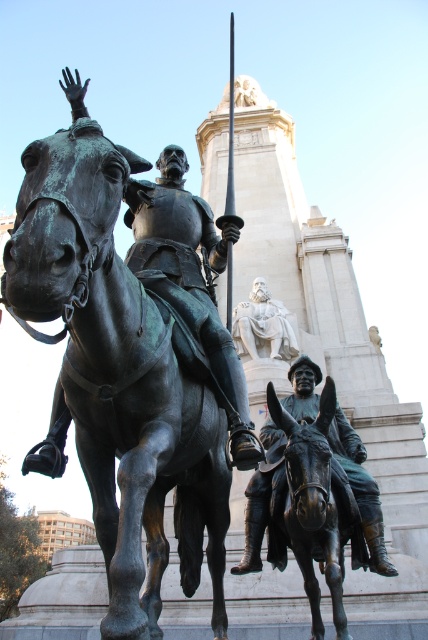
Can you confirm if bronze horse at lower center is smaller than bronze statue of man on donkey at lower right?

Correct, bronze horse at lower center occupies less space than bronze statue of man on donkey at lower right.

How far apart are bronze horse at lower center and bronze statue of man on donkey at lower right?

bronze horse at lower center is 2.13 meters away from bronze statue of man on donkey at lower right.

What do you see at coordinates (314, 508) in the screenshot? I see `bronze horse at lower center` at bounding box center [314, 508].

This screenshot has width=428, height=640. I want to click on bronze horse at lower center, so click(314, 508).

Between green patina horse at center and bronze statue of man on donkey at lower right, which one is positioned higher?

green patina horse at center is higher up.

Does point (204, 484) lie behind point (376, 508)?

No, it is not.

At what (x,y) coordinates should I click in order to perform the action: click on green patina horse at center. Please return your answer as a coordinate pair (x, y). Looking at the image, I should click on (118, 374).

Is point (219, 589) less distant than point (287, 344)?

Yes, point (219, 589) is closer to viewer.

Between point (109, 465) and point (293, 352), which one is positioned behind?

The point (293, 352) is more distant.

Is point (86, 157) closer to viewer compared to point (237, 314)?

That is True.

Identify the location of green patina horse at center. The width and height of the screenshot is (428, 640). (118, 374).